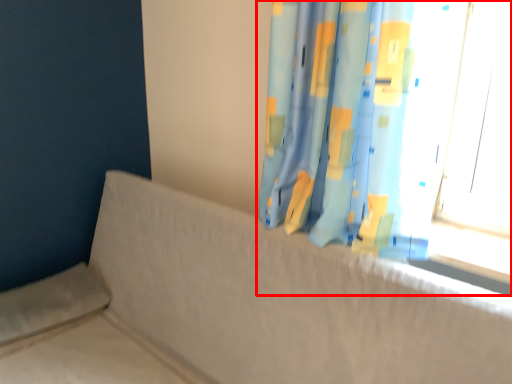
Question: Considering the relative positions of curtain (annotated by the red box) and couch in the image provided, where is curtain (annotated by the red box) located with respect to the staircase?

Choices:
 (A) right
 (B) left

Answer: (A)